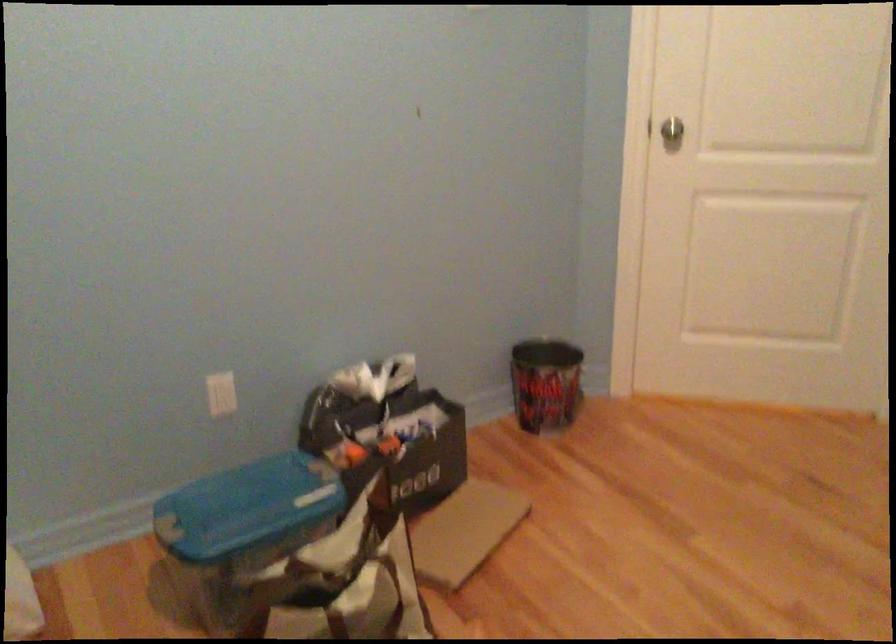
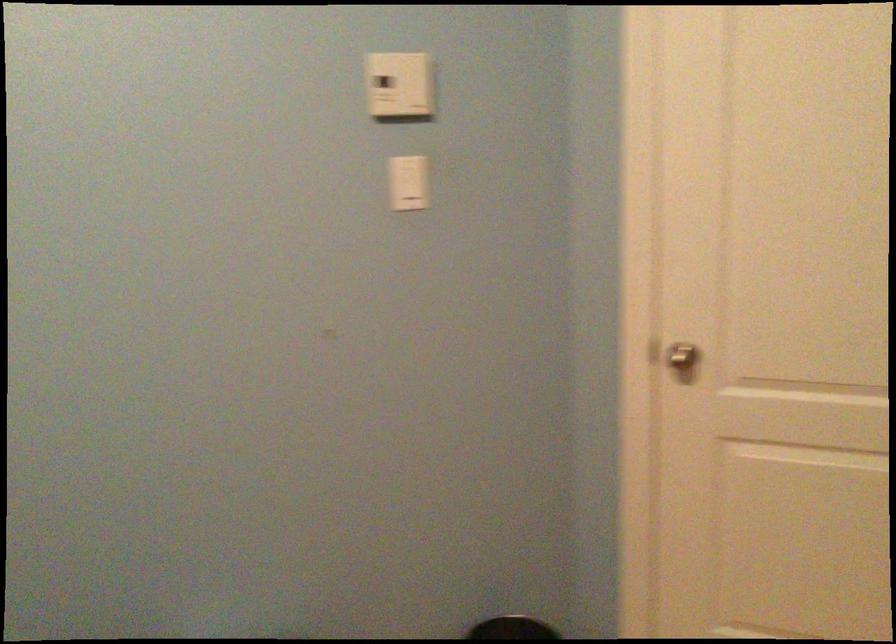
What movement of the cameraman would produce the second image?

The cameraman walked toward right, forward.